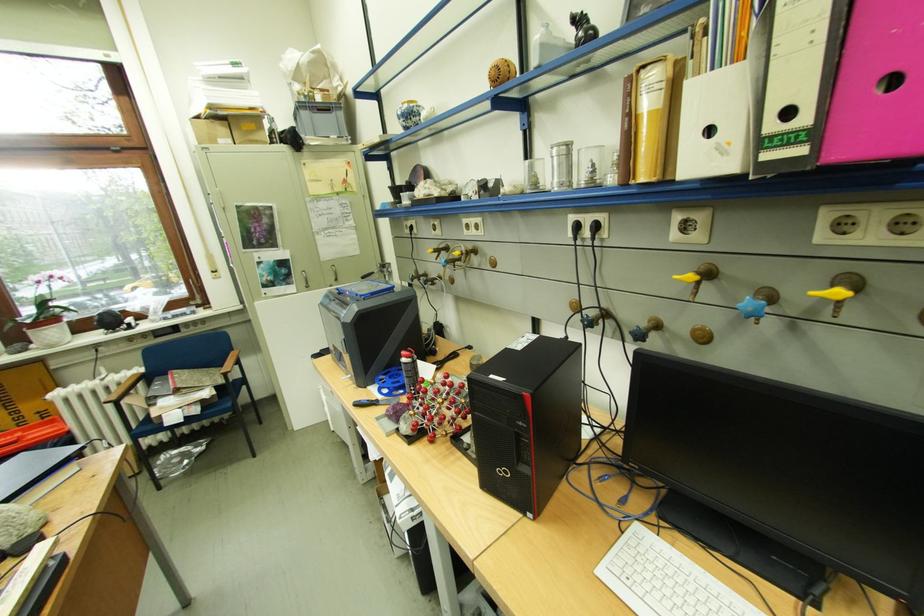
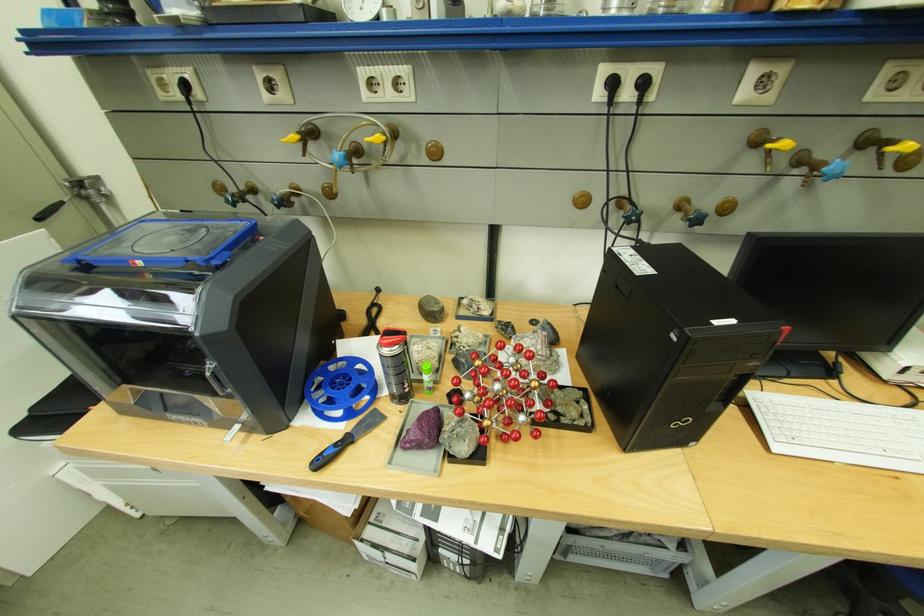
Locate, in the second image, the point that corresponds to [495,256] in the first image.

(428, 140)